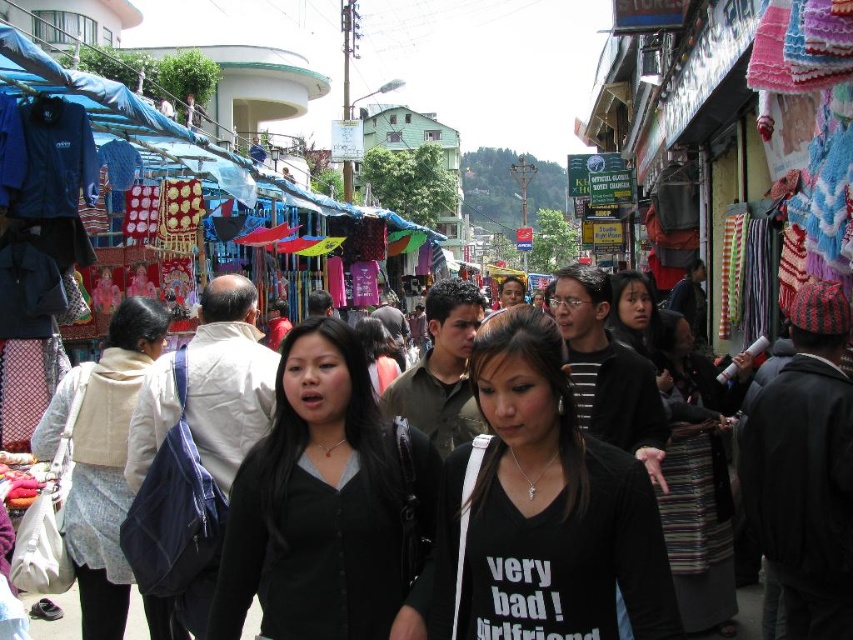
Question: Which is nearer to the black matte cardigan at center?

Choices:
 (A) striped fabric skirt at center
 (B) beige fabric bag at center
 (C) black matte shirt at center
 (D) black fabric at center

Answer: (C)

Question: Can you confirm if black matte cardigan at center is positioned above striped fabric skirt at center?

Choices:
 (A) no
 (B) yes

Answer: (A)

Question: Is beige fabric bag at center thinner than black fabric at center?

Choices:
 (A) no
 (B) yes

Answer: (A)

Question: Where is black matte shirt at center located in relation to black fabric at center in the image?

Choices:
 (A) above
 (B) below

Answer: (B)

Question: Which object is positioned closest to the beige fabric bag at center?

Choices:
 (A) black matte cardigan at center
 (B) black matte shirt at center
 (C) striped fabric skirt at center
 (D) black fabric at center

Answer: (A)

Question: Which point is closer to the camera?

Choices:
 (A) beige fabric bag at center
 (B) black fabric at center

Answer: (A)